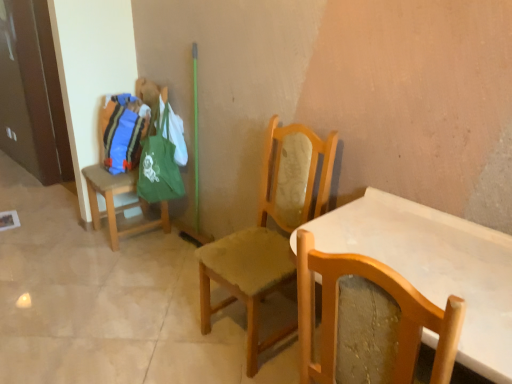
Question: In which direction should I rotate to look at wooden chair at center, which ranks as the second chair in back-to-front order?

Choices:
 (A) right
 (B) left

Answer: (A)

Question: From a real-world perspective, is wooden chair at right, which ranks as the third chair in back-to-front order, over wooden stool at left, which is the first chair in left-to-right order?

Choices:
 (A) yes
 (B) no

Answer: (A)

Question: Is wooden chair at right, which ranks as the third chair in back-to-front order, positioned before wooden stool at left, which is the first chair in left-to-right order?

Choices:
 (A) no
 (B) yes

Answer: (B)

Question: Are wooden chair at right, which ranks as the third chair in back-to-front order, and wooden stool at left, which is the first chair in left-to-right order, beside each other?

Choices:
 (A) no
 (B) yes

Answer: (A)

Question: Is wooden stool at left, the third chair when ordered from front to back, inside wooden chair at right, which ranks as the third chair in back-to-front order?

Choices:
 (A) yes
 (B) no

Answer: (B)

Question: Can you confirm if wooden chair at right, arranged as the third chair when viewed from the left, is shorter than wooden stool at left, acting as the third chair starting from the right?

Choices:
 (A) yes
 (B) no

Answer: (A)

Question: Considering the relative positions of wooden chair at right, which is the first chair in front-to-back order, and wooden stool at left, acting as the 1th chair starting from the back, in the image provided, is wooden chair at right, which is the first chair in front-to-back order, to the left of wooden stool at left, acting as the 1th chair starting from the back, from the viewer's perspective?

Choices:
 (A) yes
 (B) no

Answer: (B)

Question: Is wooden chair at center, arranged as the 2th chair when viewed from the right, next to wooden stool at left, acting as the 1th chair starting from the back?

Choices:
 (A) no
 (B) yes

Answer: (A)

Question: Considering the relative sizes of wooden chair at center, which ranks as the second chair in back-to-front order, and wooden stool at left, acting as the 1th chair starting from the back, in the image provided, is wooden chair at center, which ranks as the second chair in back-to-front order, bigger than wooden stool at left, acting as the 1th chair starting from the back,?

Choices:
 (A) yes
 (B) no

Answer: (A)

Question: Does wooden chair at center, the second chair from the front, lie in front of wooden stool at left, acting as the third chair starting from the right?

Choices:
 (A) no
 (B) yes

Answer: (B)

Question: Is wooden chair at center, which ranks as the second chair in back-to-front order, wider than wooden stool at left, the third chair when ordered from front to back?

Choices:
 (A) yes
 (B) no

Answer: (B)

Question: Is wooden stool at left, which is the first chair in left-to-right order, at the back of wooden chair at center, arranged as the 2th chair when viewed from the right?

Choices:
 (A) no
 (B) yes

Answer: (A)

Question: Considering the relative sizes of wooden chair at center, the second chair from the front, and wooden stool at left, acting as the 1th chair starting from the back, in the image provided, is wooden chair at center, the second chair from the front, smaller than wooden stool at left, acting as the 1th chair starting from the back,?

Choices:
 (A) yes
 (B) no

Answer: (B)

Question: Is wooden stool at left, which is the first chair in left-to-right order, further to the viewer compared to wooden chair at center, placed as the 2th chair when sorted from left to right?

Choices:
 (A) yes
 (B) no

Answer: (A)